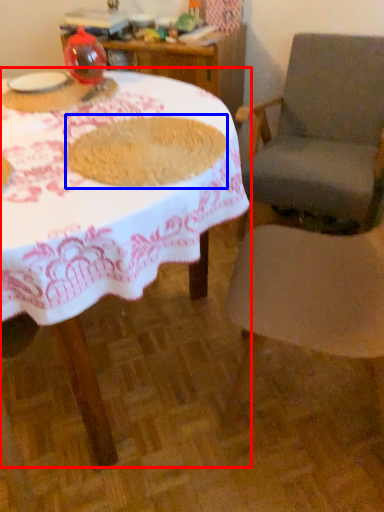
Question: Among these objects, which one is nearest to the camera, table (highlighted by a red box) or food (highlighted by a blue box)?

Choices:
 (A) table
 (B) food

Answer: (A)